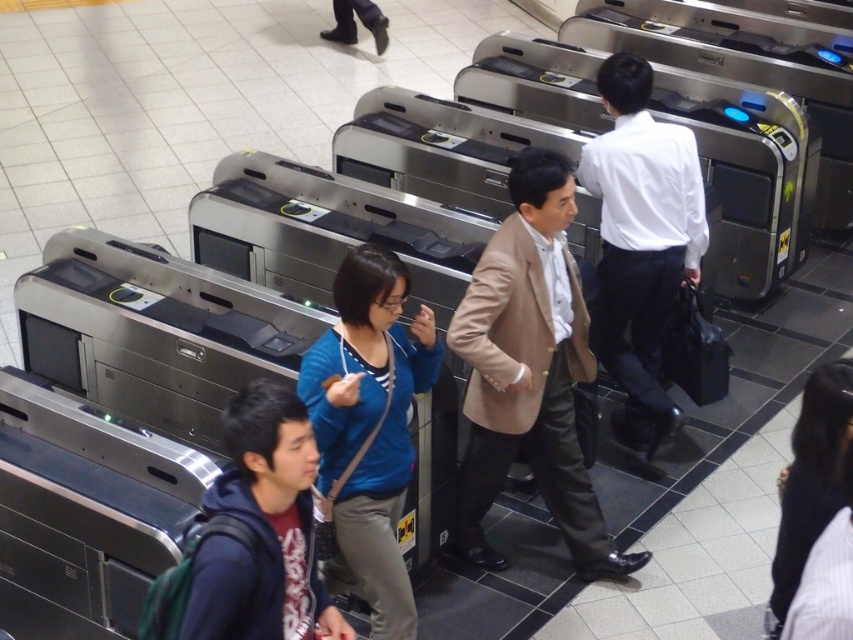
Is dark blue hoodie at center bigger than dark gray fabric jacket at center?

Yes.

From the picture: Which is more to the right, dark blue hoodie at center or dark gray fabric jacket at center?

dark gray fabric jacket at center is more to the right.

Is point (302, 536) in front of point (845, 440)?

Yes, it is in front of point (845, 440).

Locate an element on the screen. The width and height of the screenshot is (853, 640). dark blue hoodie at center is located at coordinates (260, 529).

Does dark gray fabric jacket at center have a greater width compared to black leather shoes at upper center?

No, dark gray fabric jacket at center is not wider than black leather shoes at upper center.

Measure the distance between dark gray fabric jacket at center and camera.

They are 3.30 meters apart.

Find the location of a particular element. dark gray fabric jacket at center is located at coordinates (810, 481).

Does point (647, 451) come closer to viewer compared to point (375, 24)?

Yes, it is in front of point (375, 24).

Which of these two, white glossy shirt at upper right or black leather shoes at upper center, stands shorter?

Standing shorter between the two is black leather shoes at upper center.

Who is more forward, (x=628, y=124) or (x=376, y=28)?

Point (x=628, y=124) is in front.

At what (x,y) coordinates should I click in order to perform the action: click on white glossy shirt at upper right. Please return your answer as a coordinate pair (x, y). This screenshot has height=640, width=853. Looking at the image, I should click on (641, 243).